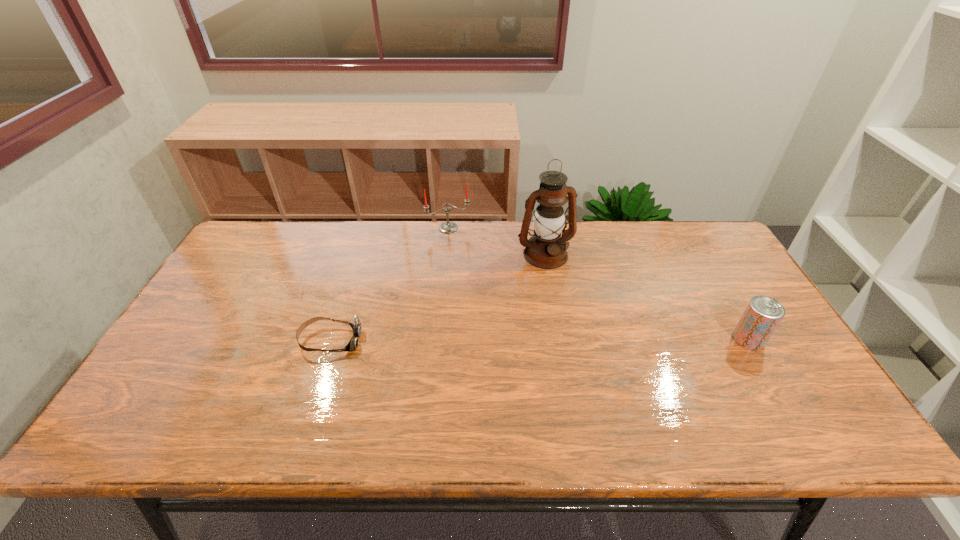
Where is `vacant spot on the desktop that is between the goggles and the rightmost object and is positioned on the side of the lantern, there is a wick adjustment knob`? vacant spot on the desktop that is between the goggles and the rightmost object and is positioned on the side of the lantern, there is a wick adjustment knob is located at coordinates (589, 340).

Identify the location of free space on the desktop that is between the shortest object and the rightmost object and is positioned on the front-facing side of the third object from right to left. (496, 340).